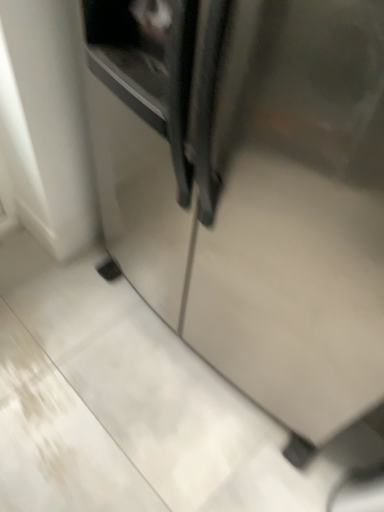
What do you see at coordinates (251, 190) in the screenshot? This screenshot has height=512, width=384. I see `stainless steel refrigerator at center` at bounding box center [251, 190].

I want to click on stainless steel refrigerator at center, so click(x=251, y=190).

Where is `stainless steel refrigerator at center`? stainless steel refrigerator at center is located at coordinates (251, 190).